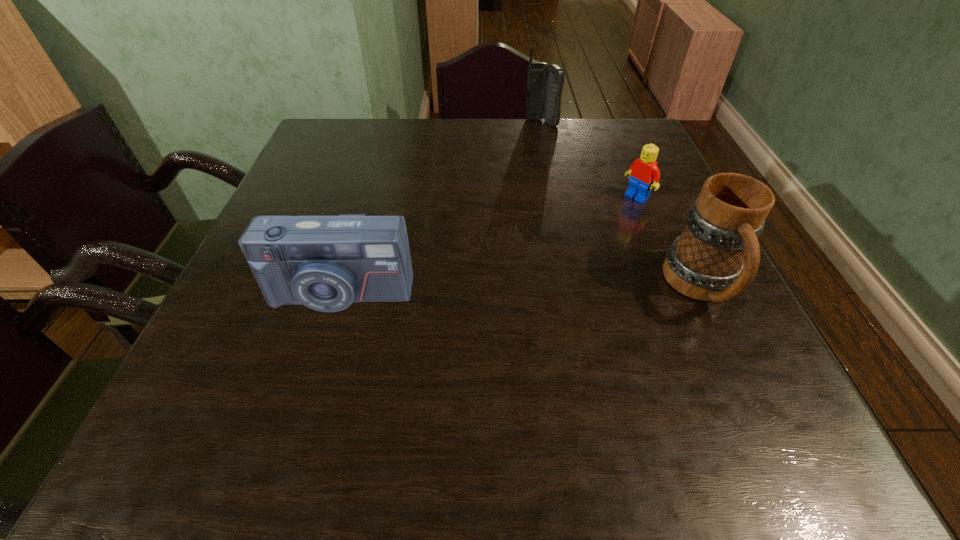
Find the location of a particular element. vacant region located on the face of the shortest object is located at coordinates (549, 258).

This screenshot has height=540, width=960. Identify the location of vacant area located on the keyboard of the cellular telephone. (550, 207).

In order to click on vacant region located on the keyboard of the cellular telephone in this screenshot , I will do `click(547, 183)`.

Image resolution: width=960 pixels, height=540 pixels. In order to click on vacant area located 0.340m on the keyboard of the cellular telephone in this screenshot , I will do `click(549, 197)`.

I want to click on object that is at the far edge, so click(x=544, y=84).

At what (x,y) coordinates should I click in order to perform the action: click on object located in the left edge section of the desktop. Please return your answer as a coordinate pair (x, y). The width and height of the screenshot is (960, 540). Looking at the image, I should click on (326, 263).

Find the location of a particular element. mug at the right edge is located at coordinates (706, 263).

Where is `Lego that is at the right edge`? This screenshot has height=540, width=960. Lego that is at the right edge is located at coordinates (644, 174).

Where is `free space at the far edge of the desktop`? free space at the far edge of the desktop is located at coordinates 520,138.

I want to click on vacant space at the near edge of the desktop, so click(x=521, y=379).